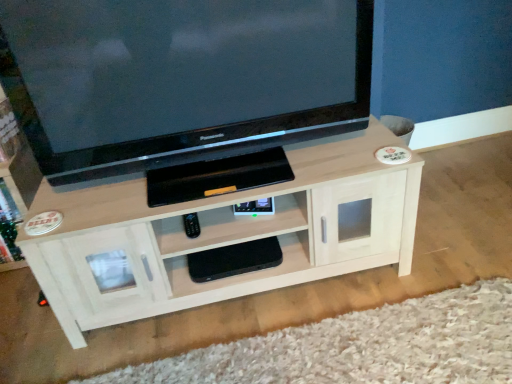
Question: From a real-world perspective, is white wood tv cabinet at lower left physically above black matte gaming console at center, the second shelf viewed from the top?

Choices:
 (A) no
 (B) yes

Answer: (B)

Question: Is white wood tv cabinet at lower left turned away from black matte gaming console at center, the second shelf viewed from the top?

Choices:
 (A) no
 (B) yes

Answer: (A)

Question: Is white wood tv cabinet at lower left facing towards black matte gaming console at center, the 1th shelf positioned from the bottom?

Choices:
 (A) yes
 (B) no

Answer: (B)

Question: From the image's perspective, is white wood tv cabinet at lower left over black matte gaming console at center, the 1th shelf positioned from the bottom?

Choices:
 (A) no
 (B) yes

Answer: (B)

Question: Can you confirm if white wood tv cabinet at lower left is bigger than black matte gaming console at center, the 1th shelf positioned from the bottom?

Choices:
 (A) no
 (B) yes

Answer: (B)

Question: Considering the positions of black glossy television at upper center and black matte gaming console at center, the second shelf viewed from the top, in the image, is black glossy television at upper center wider or thinner than black matte gaming console at center, the second shelf viewed from the top,?

Choices:
 (A) thin
 (B) wide

Answer: (B)

Question: Is black glossy television at upper center bigger or smaller than black matte gaming console at center, the second shelf viewed from the top?

Choices:
 (A) big
 (B) small

Answer: (A)

Question: Considering the positions of point (205, 77) and point (182, 256), is point (205, 77) closer or farther from the camera than point (182, 256)?

Choices:
 (A) closer
 (B) farther

Answer: (A)

Question: Would you say black glossy television at upper center is to the left or to the right of black matte gaming console at center, the 1th shelf positioned from the bottom, in the picture?

Choices:
 (A) right
 (B) left

Answer: (B)

Question: Is black matte gaming console at center, the 1th shelf positioned from the bottom, wider or thinner than black glossy television at upper center?

Choices:
 (A) thin
 (B) wide

Answer: (A)

Question: Considering the relative positions of black matte gaming console at center, the 1th shelf positioned from the bottom, and black glossy television at upper center in the image provided, is black matte gaming console at center, the 1th shelf positioned from the bottom, to the left or to the right of black glossy television at upper center?

Choices:
 (A) right
 (B) left

Answer: (A)

Question: Looking at the image, does black matte gaming console at center, the second shelf viewed from the top, seem bigger or smaller compared to black glossy television at upper center?

Choices:
 (A) big
 (B) small

Answer: (B)

Question: Choose the correct answer: Is black matte gaming console at center, the second shelf viewed from the top, inside black glossy television at upper center or outside it?

Choices:
 (A) inside
 (B) outside

Answer: (B)

Question: Considering the positions of point (111, 304) and point (31, 163), is point (111, 304) closer or farther from the camera than point (31, 163)?

Choices:
 (A) closer
 (B) farther

Answer: (A)

Question: Is light wood shelf at center, marked as the second shelf in a bottom-to-top arrangement, wider or thinner than white wood tv cabinet at lower left?

Choices:
 (A) thin
 (B) wide

Answer: (B)